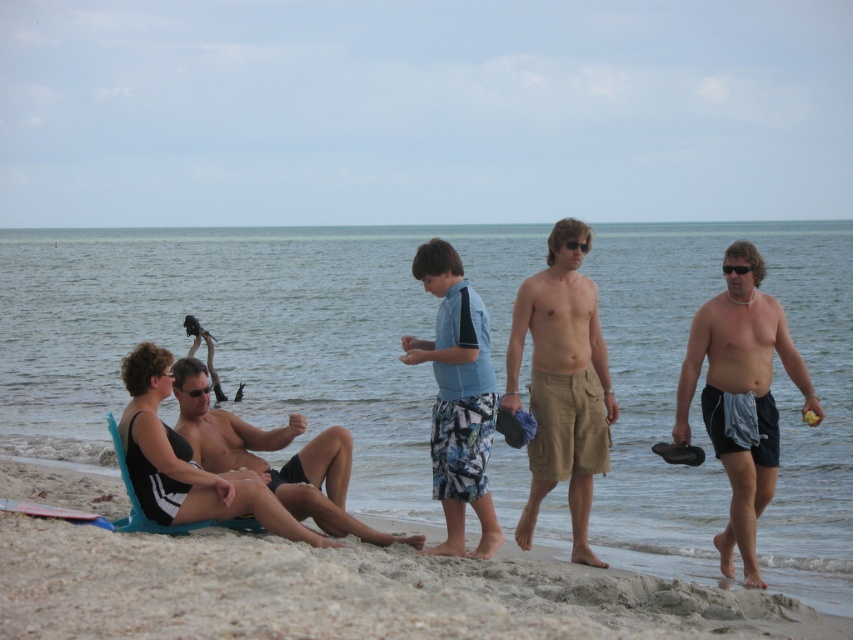
You are a photographer wanting to capture a photo of the black matte swimsuit at center and the gray fabric towel at right. Since you want both items to be clearly visible in the frame, which one should you focus on first to ensure proper focus?

The gray fabric towel at right is shorter than the black matte swimsuit at center, so you should focus on the black matte swimsuit at center first as it is taller and more prominent in the scene.